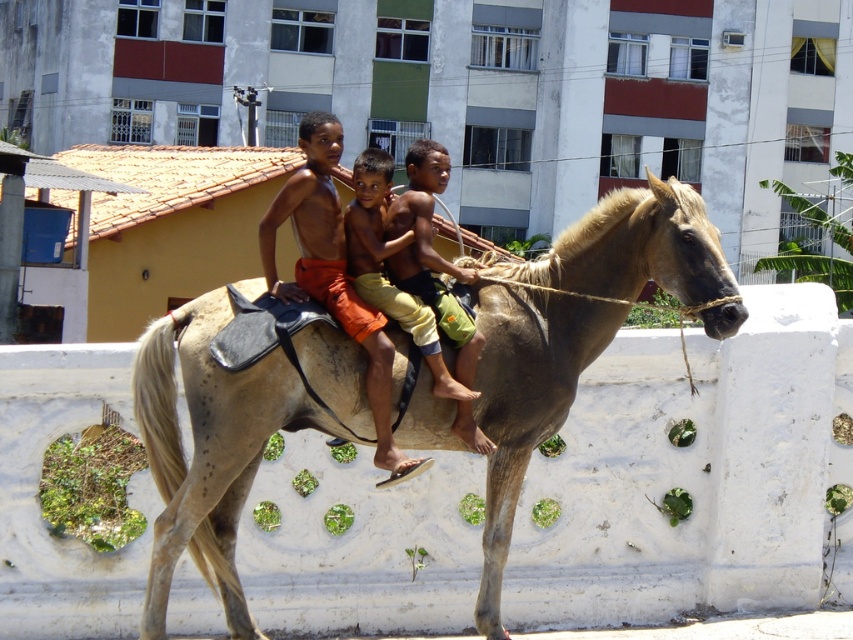
Who is positioned more to the right, light brown leather horse at center or tan skin boy at center?

light brown leather horse at center is more to the right.

Does light brown leather horse at center have a larger size compared to tan skin boy at center?

Yes, light brown leather horse at center is bigger than tan skin boy at center.

Does point (219, 301) lie behind point (468, 390)?

That is True.

Locate an element on the screen. This screenshot has width=853, height=640. light brown leather horse at center is located at coordinates (573, 333).

Which is more to the left, light brown skin at center or tan skin boy at center?

From the viewer's perspective, light brown skin at center appears more on the left side.

This screenshot has height=640, width=853. What do you see at coordinates (332, 273) in the screenshot? I see `light brown skin at center` at bounding box center [332, 273].

The width and height of the screenshot is (853, 640). I want to click on light brown skin at center, so click(x=332, y=273).

Locate an element on the screen. The width and height of the screenshot is (853, 640). light brown skin at center is located at coordinates click(332, 273).

Does light brown leather horse at center come behind light brown skin at center?

No.

Which is above, light brown leather horse at center or light brown skin at center?

light brown leather horse at center

Between point (488, 573) and point (331, 212), which one is positioned behind?

The point (488, 573) is more distant.

Where is `light brown leather horse at center`? The height and width of the screenshot is (640, 853). light brown leather horse at center is located at coordinates (573, 333).